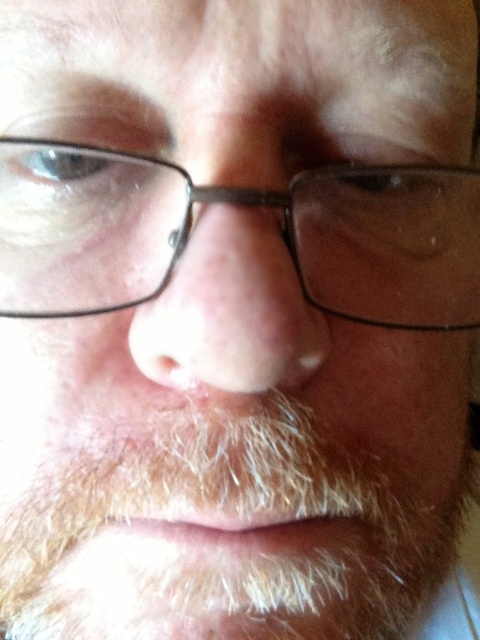
Measure the distance between white fuzzy beard at lower center and camera.

22.45 centimeters

Between point (392, 580) and point (196, 380), which one is positioned behind?

Point (392, 580)

This screenshot has height=640, width=480. What are the coordinates of `white fuzzy beard at lower center` in the screenshot? It's located at pyautogui.click(x=227, y=541).

From the picture: How much distance is there between black plastic glasses at center and smooth skin nose at center?

They are 1.51 inches apart.

Which is in front, point (452, 218) or point (226, 365)?

Positioned in front is point (226, 365).

Where is `black plastic glasses at center`? This screenshot has width=480, height=640. black plastic glasses at center is located at coordinates (240, 205).

Does white fuzzy beard at lower center have a greater width compared to black plastic glasses at center?

Yes.

Who is positioned more to the right, white fuzzy beard at lower center or black plastic glasses at center?

white fuzzy beard at lower center is more to the right.

What do you see at coordinates (227, 541) in the screenshot?
I see `white fuzzy beard at lower center` at bounding box center [227, 541].

Locate an element on the screen. The width and height of the screenshot is (480, 640). white fuzzy beard at lower center is located at coordinates (227, 541).